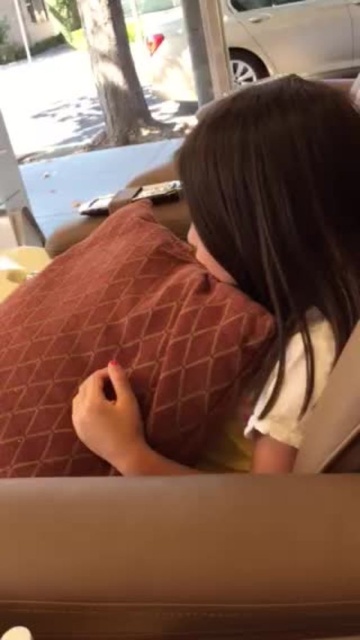
Which is more to the left, matte brown pillow at center or silver metallic car at upper center?

matte brown pillow at center is more to the left.

Describe the element at coordinates (281, 234) in the screenshot. I see `matte brown pillow at center` at that location.

Who is more distant from viewer, [219,173] or [312,20]?

Point [312,20]

At what (x,y) coordinates should I click in order to perform the action: click on matte brown pillow at center. Please return your answer as a coordinate pair (x, y). The image size is (360, 640). Looking at the image, I should click on (281, 234).

Can you confirm if velvet-like brown pillow at center is positioned above silver metallic car at upper center?

No.

Which is in front, point (136, 312) or point (348, 56)?

Positioned in front is point (136, 312).

The height and width of the screenshot is (640, 360). Find the location of `velvet-like brown pillow at center`. velvet-like brown pillow at center is located at coordinates (123, 346).

Does matte brown pillow at center appear on the left side of velvet-like brown pillow at center?

Incorrect, matte brown pillow at center is not on the left side of velvet-like brown pillow at center.

Can you confirm if matte brown pillow at center is wider than velvet-like brown pillow at center?

No.

Is point (280, 122) less distant than point (146, 358)?

Yes.

In order to click on matte brown pillow at center in this screenshot , I will do `click(281, 234)`.